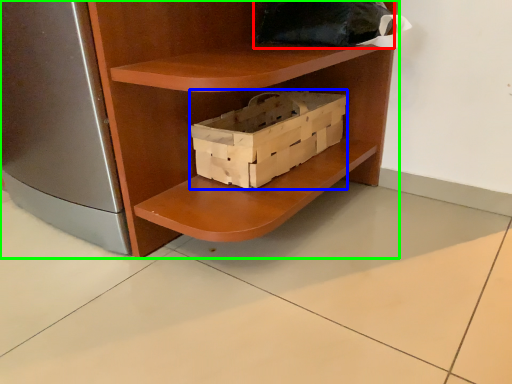
Question: Considering the real-world distances, which object is farthest from pillow (highlighted by a red box)? box (highlighted by a blue box) or shelf (highlighted by a green box)?

Choices:
 (A) box
 (B) shelf

Answer: (B)